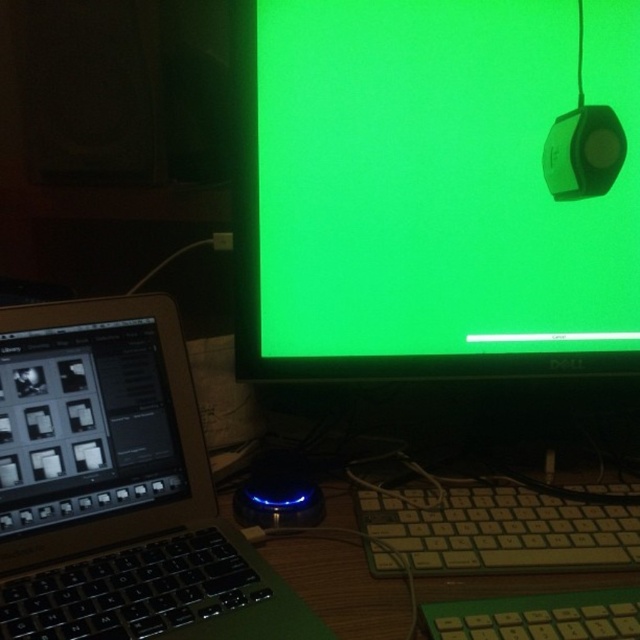
You have a small toy car that is 6 inches long. You want to place it between the satin black laptop at left and the blue led mouse at center. Will the toy car fit in the space between them?

The satin black laptop at left is 6.32 inches away from the blue led mouse at center. Since the toy car is 6 inches long, it will fit in the space between them as the distance is slightly larger than the car.

You are organizing cables for a workspace. You need to connect a new cable between the green matte monitor at upper center and the black matte screen at lower left. What is the minimum length of cable you need to ensure a proper connection without any strain?

The minimum length of cable required is 29.62 centimeters to ensure a proper connection between the green matte monitor at upper center and the black matte screen at lower left without any strain.

You are setting up a new desk and need to place a keyboard and a mouse. The black matte screen at lower left is on your desk. Where should you place the blue led mouse at center to ensure it doesn not block the screen?

The black matte screen at lower left is bigger than the blue led mouse at center, so placing the blue led mouse at center to the side or below the screen would prevent it from blocking the larger screen.